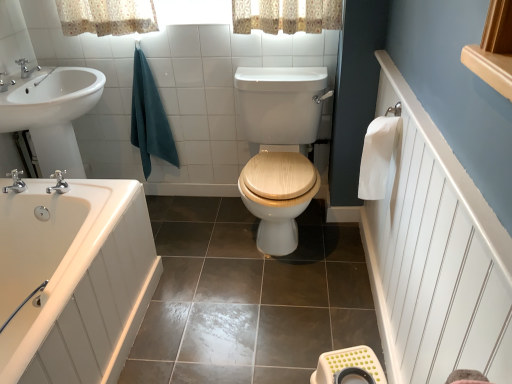
What do you see at coordinates (74, 279) in the screenshot?
I see `white glossy bathtub at lower left` at bounding box center [74, 279].

What do you see at coordinates (26, 68) in the screenshot? The image size is (512, 384). I see `brushed metal faucet at upper left, the 1th tap when ordered from back to front` at bounding box center [26, 68].

You are a GUI agent. You are given a task and a screenshot of the screen. Output one action in this format:
    pyautogui.click(x=<x>, y=<y>)
    Task: Click on the teal cotton towel at upper left, marked as the first bath towel in a back-to-front arrangement
    The width and height of the screenshot is (512, 384).
    Given the screenshot: What is the action you would take?
    pyautogui.click(x=149, y=118)

What do you see at coordinates (149, 118) in the screenshot? Image resolution: width=512 pixels, height=384 pixels. I see `teal cotton towel at upper left, marked as the first bath towel in a back-to-front arrangement` at bounding box center [149, 118].

This screenshot has width=512, height=384. What are the coordinates of `wooden at center` in the screenshot? It's located at (281, 103).

Where is `white glossy bathtub at lower left`? white glossy bathtub at lower left is located at coordinates (74, 279).

In the image, is silver metallic faucet at left, which is the first tap in bottom-to-top order, positioned in front of or behind white paper towel at right, which ranks as the second bath towel in left-to-right order?

Clearly, silver metallic faucet at left, which is the first tap in bottom-to-top order, is behind white paper towel at right, which ranks as the second bath towel in left-to-right order.

Based on the photo, is silver metallic faucet at left, which is the first tap in front-to-back order, oriented towards white paper towel at right, the 1th bath towel viewed from the right?

No, silver metallic faucet at left, which is the first tap in front-to-back order, does not turn towards white paper towel at right, the 1th bath towel viewed from the right.

From the picture: Is white paper towel at right, the 1th bath towel viewed from the right, completely or partially inside silver metallic faucet at left, which is the first tap in bottom-to-top order?

Definitely not — white paper towel at right, the 1th bath towel viewed from the right, is not inside silver metallic faucet at left, which is the first tap in bottom-to-top order.

Are silver metallic faucet at left, which is the first tap in front-to-back order, and white paper towel at right, which ranks as the second bath towel in left-to-right order, beside each other?

Result: No.

Considering the sizes of silver metallic faucet at left, which is the first tap in bottom-to-top order, and white glossy bathtub at lower left in the image, is silver metallic faucet at left, which is the first tap in bottom-to-top order, taller or shorter than white glossy bathtub at lower left?

Considering their sizes, silver metallic faucet at left, which is the first tap in bottom-to-top order, has less height than white glossy bathtub at lower left.

Is silver metallic faucet at left, which is the 3th tap from back to front, not inside white glossy bathtub at lower left?

Yes, silver metallic faucet at left, which is the 3th tap from back to front, is not within white glossy bathtub at lower left.

Measure the distance between silver metallic faucet at left, which is the first tap in front-to-back order, and white glossy bathtub at lower left.

silver metallic faucet at left, which is the first tap in front-to-back order, and white glossy bathtub at lower left are 18.77 inches apart.

Can you confirm if silver metallic faucet at left, which is the 3th tap from back to front, is smaller than white glossy bathtub at lower left?

Indeed, silver metallic faucet at left, which is the 3th tap from back to front, has a smaller size compared to white glossy bathtub at lower left.

Where is `toilet lying below the teal cotton towel at upper left, marked as the first bath towel in a back-to-front arrangement (from the image's perspective)`? toilet lying below the teal cotton towel at upper left, marked as the first bath towel in a back-to-front arrangement (from the image's perspective) is located at coordinates (281, 103).

Is wooden at center oriented towards teal cotton towel at upper left, marked as the first bath towel in a back-to-front arrangement?

No, wooden at center is not turned towards teal cotton towel at upper left, marked as the first bath towel in a back-to-front arrangement.

From a real-world perspective, relative to teal cotton towel at upper left, which appears as the second bath towel when viewed from the front, is wooden at center vertically above or below?

Clearly, from a real-world perspective, wooden at center is below teal cotton towel at upper left, which appears as the second bath towel when viewed from the front.

Does wooden at center lie in front of teal cotton towel at upper left, arranged as the 2th bath towel when viewed from the right?

Yes, the depth of wooden at center is less than that of teal cotton towel at upper left, arranged as the 2th bath towel when viewed from the right.

Can you confirm if silver metallic faucet at left, which appears as the 3th tap when viewed from the top, is taller than white plastic stool at lower right?

In fact, silver metallic faucet at left, which appears as the 3th tap when viewed from the top, may be shorter than white plastic stool at lower right.

Is white plastic stool at lower right surrounded by silver metallic faucet at left, which is the first tap in bottom-to-top order?

No, white plastic stool at lower right is located outside of silver metallic faucet at left, which is the first tap in bottom-to-top order.

Based on their sizes in the image, would you say silver metallic faucet at left, which is the first tap in front-to-back order, is bigger or smaller than white plastic stool at lower right?

Clearly, silver metallic faucet at left, which is the first tap in front-to-back order, is smaller in size than white plastic stool at lower right.

You are a GUI agent. You are given a task and a screenshot of the screen. Output one action in this format:
    pyautogui.click(x=<x>, y=<y>)
    Task: Click on the 1st tap below when counting from the brushed metal faucet at upper left, which ranks as the 3th tap in bottom-to-top order (from the image's perspective)
    
    Given the screenshot: What is the action you would take?
    pyautogui.click(x=5, y=82)

Would you say silver metallic faucet at upper left, acting as the second tap starting from the top, is to the left or to the right of brushed metal faucet at upper left, which ranks as the 1th tap in top-to-bottom order, in the picture?

silver metallic faucet at upper left, acting as the second tap starting from the top, is positioned on brushed metal faucet at upper left, which ranks as the 1th tap in top-to-bottom order,'s right side.

Is silver metallic faucet at upper left, acting as the second tap starting from the top, not close to brushed metal faucet at upper left, which is the third tap in front-to-back order?

That's not correct — silver metallic faucet at upper left, acting as the second tap starting from the top, is a little close to brushed metal faucet at upper left, which is the third tap in front-to-back order.

Is silver metallic faucet at upper left, which is the 2th tap in bottom-to-top order, aimed at brushed metal faucet at upper left, which ranks as the 1th tap in top-to-bottom order?

No, silver metallic faucet at upper left, which is the 2th tap in bottom-to-top order, is not aimed at brushed metal faucet at upper left, which ranks as the 1th tap in top-to-bottom order.

Is point (379, 189) closer to viewer compared to point (326, 373)?

No, (379, 189) is behind (326, 373).

From the image's perspective, would you say white paper towel at right, which ranks as the 1th bath towel in front-to-back order, is shown under white plastic stool at lower right?

No.

Is white paper towel at right, which ranks as the 1th bath towel in front-to-back order, situated inside white plastic stool at lower right or outside?

white paper towel at right, which ranks as the 1th bath towel in front-to-back order, is spatially situated outside white plastic stool at lower right.

Is white plastic stool at lower right at the back of white paper towel at right, which ranks as the 1th bath towel in front-to-back order?

No.

Who is taller, wooden at center or brushed metal faucet at upper left, which ranks as the 3th tap in bottom-to-top order?

With more height is wooden at center.

Considering the positions of objects wooden at center and brushed metal faucet at upper left, which ranks as the 3th tap in bottom-to-top order, in the image provided, who is more to the right, wooden at center or brushed metal faucet at upper left, which ranks as the 3th tap in bottom-to-top order,?

wooden at center.

Is point (315, 112) positioned behind point (30, 75)?

No, it is in front of (30, 75).

From a real-world perspective, is wooden at center positioned above or below brushed metal faucet at upper left, the 1th tap when ordered from back to front?

From a real-world perspective, wooden at center is physically below brushed metal faucet at upper left, the 1th tap when ordered from back to front.

Where is `the 2nd bath towel to the right of the silver metallic faucet at left, which is the first tap in front-to-back order, starting your count from the anchor`? The width and height of the screenshot is (512, 384). the 2nd bath towel to the right of the silver metallic faucet at left, which is the first tap in front-to-back order, starting your count from the anchor is located at coordinates (378, 156).

This screenshot has height=384, width=512. Identify the location of bathtub that is below the silver metallic faucet at left, which is the first tap in front-to-back order (from the image's perspective). (74, 279).

Which object lies nearer to the anchor point wooden at center, silver metallic faucet at upper left, the second tap from the back, or white plastic stool at lower right?

white plastic stool at lower right is closer to wooden at center.

Considering their positions, is white plastic stool at lower right positioned further to white paper towel at right, the 1th bath towel viewed from the right, than wooden at center?

white plastic stool at lower right is further to white paper towel at right, the 1th bath towel viewed from the right.

Consider the image. When comparing their distances from teal cotton towel at upper left, which appears as the second bath towel when viewed from the front, does white plastic stool at lower right or silver metallic faucet at left, which is the 3th tap from back to front, seem closer?

silver metallic faucet at left, which is the 3th tap from back to front, is closer to teal cotton towel at upper left, which appears as the second bath towel when viewed from the front.

Looking at this image, based on their spatial positions, is silver metallic faucet at upper left, the second tap when ordered from front to back, or white paper towel at right, which ranks as the 1th bath towel in front-to-back order, closer to brushed metal faucet at upper left, which ranks as the 3th tap in bottom-to-top order?

Among the two, silver metallic faucet at upper left, the second tap when ordered from front to back, is located nearer to brushed metal faucet at upper left, which ranks as the 3th tap in bottom-to-top order.

Considering their positions, is silver metallic faucet at upper left, which is the 2th tap in bottom-to-top order, positioned closer to white glossy bathtub at lower left than wooden at center?

The object closer to white glossy bathtub at lower left is wooden at center.

Based on their spatial positions, is white paper towel at right, the second bath towel from the back, or white plastic stool at lower right further from silver metallic faucet at left, which is the first tap in bottom-to-top order?

white paper towel at right, the second bath towel from the back.

Which object lies further to the anchor point silver metallic faucet at upper left, which is the 2th tap in bottom-to-top order, silver metallic faucet at left, which is the 3th tap from back to front, or white paper towel at right, which ranks as the 1th bath towel in front-to-back order?

white paper towel at right, which ranks as the 1th bath towel in front-to-back order, is positioned further to the anchor silver metallic faucet at upper left, which is the 2th tap in bottom-to-top order.

Which object lies nearer to the anchor point silver metallic faucet at upper left, the second tap when ordered from front to back, teal cotton towel at upper left, acting as the 1th bath towel starting from the left, or white glossy bathtub at lower left?

teal cotton towel at upper left, acting as the 1th bath towel starting from the left, lies closer to silver metallic faucet at upper left, the second tap when ordered from front to back, than the other object.

Locate an element on the screen. toilet situated between teal cotton towel at upper left, which appears as the second bath towel when viewed from the front, and white paper towel at right, which ranks as the second bath towel in left-to-right order, from left to right is located at coordinates (281, 103).

The height and width of the screenshot is (384, 512). What are the coordinates of `bathtub between silver metallic faucet at left, which is the 3th tap from back to front, and wooden at center from left to right` in the screenshot? It's located at (74, 279).

I want to click on bath towel between silver metallic faucet at upper left, which is the 2th tap in bottom-to-top order, and wooden at center, so click(x=149, y=118).

Image resolution: width=512 pixels, height=384 pixels. In order to click on tap between brushed metal faucet at upper left, the 1th tap when ordered from back to front, and silver metallic faucet at left, which is the first tap in bottom-to-top order, vertically in this screenshot , I will do `click(5, 82)`.